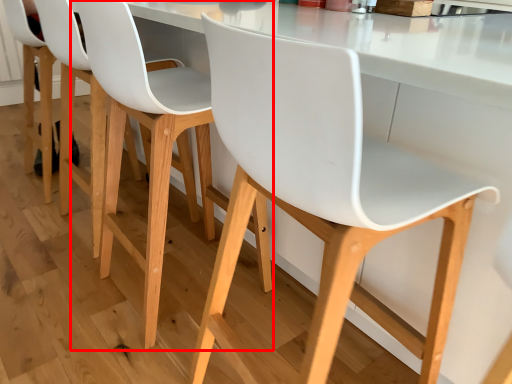
Question: Considering the relative positions of chair (annotated by the red box) and chair in the image provided, where is chair (annotated by the red box) located with respect to the staircase?

Choices:
 (A) left
 (B) right

Answer: (A)